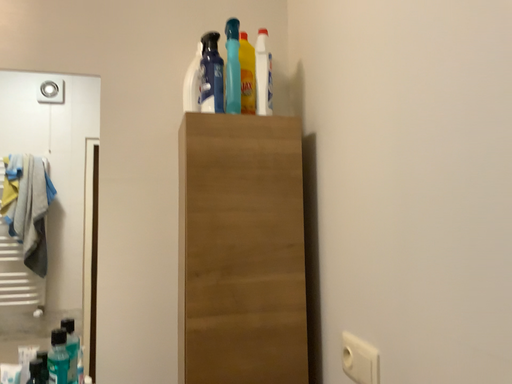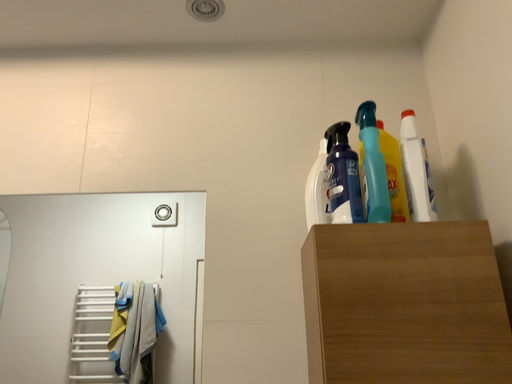
Question: How did the camera likely rotate when shooting the video?

Choices:
 (A) rotated upward
 (B) rotated downward

Answer: (A)